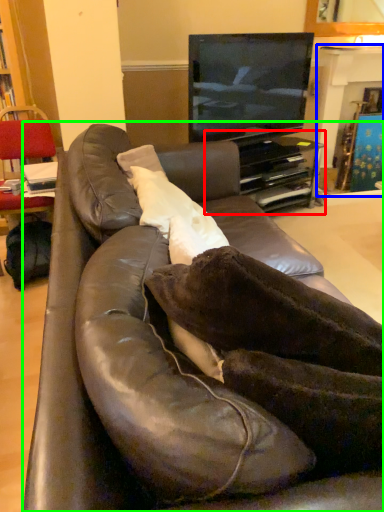
Question: Which is farther away from entertainment center (highlighted by a red box)? fireplace (highlighted by a blue box) or studio couch (highlighted by a green box)?

Choices:
 (A) fireplace
 (B) studio couch

Answer: (B)